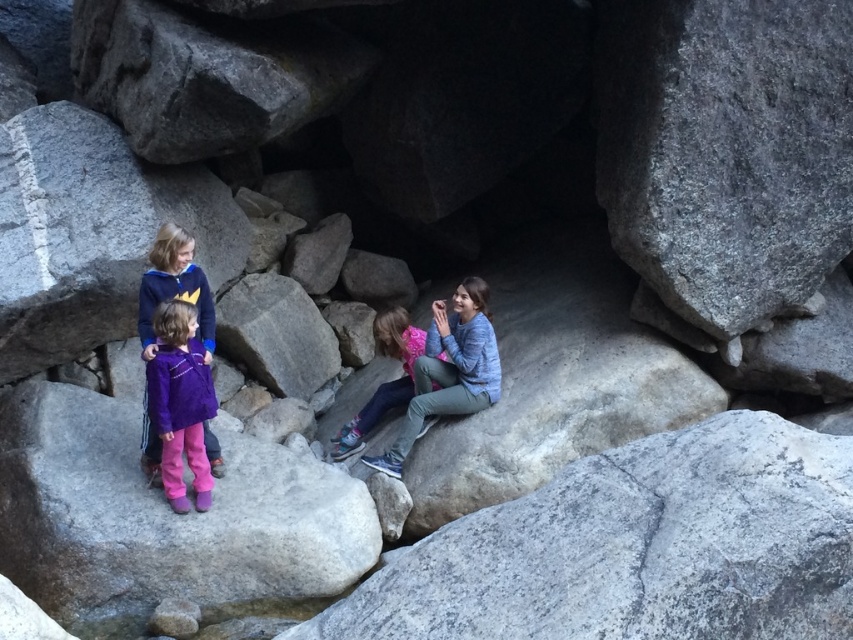
You are a hiker who wants to climb up to the pink fleece jacket at center. Which direction should you move relative to the gray rough rock at center?

The gray rough rock at center is below the pink fleece jacket at center, so you should move upward from the gray rough rock at center to reach the pink fleece jacket at center.

You are one of the children in the cave. You want to move from the point closer to you to the farther point. Which path should you take? The path goes through the rocks between the point at (189, 371) and the point at (387, 403). Is the path between them safe for walking?

The path between point (189, 371) and point (387, 403) is safe for walking since the points are positioned in the scene, but you need to be cautious as the rocks may be uneven.

You are a parent trying to locate your child who is wearing blue denim jeans at center. You see another child wearing purple fleece jacket at lower left. How far apart are the two children?

The blue denim jeans at center and purple fleece jacket at lower left are 1.32 meters apart from each other.